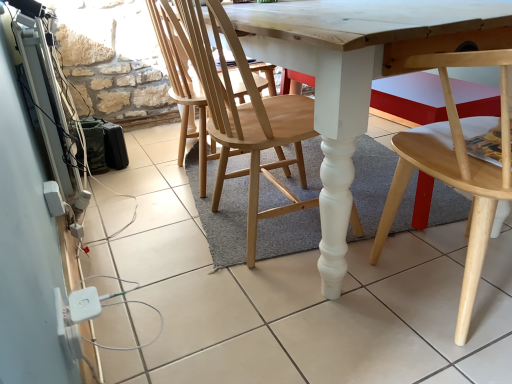
Question: Considering the relative sizes of light wood chair at lower right, the first chair in the right-to-left sequence, and natural wood chair at center, marked as the 1th chair in a left-to-right arrangement, in the image provided, is light wood chair at lower right, the first chair in the right-to-left sequence, wider than natural wood chair at center, marked as the 1th chair in a left-to-right arrangement,?

Choices:
 (A) no
 (B) yes

Answer: (B)

Question: Is the depth of light wood chair at lower right, which is the second chair in left-to-right order, less than that of natural wood chair at center, the 2th chair when ordered from right to left?

Choices:
 (A) yes
 (B) no

Answer: (A)

Question: Is light wood chair at lower right, the first chair in the right-to-left sequence, at the left side of natural wood chair at center, the 2th chair when ordered from right to left?

Choices:
 (A) no
 (B) yes

Answer: (A)

Question: Is light wood chair at lower right, the first chair in the right-to-left sequence, with natural wood chair at center, marked as the 1th chair in a left-to-right arrangement?

Choices:
 (A) yes
 (B) no

Answer: (B)

Question: Can you confirm if light wood chair at lower right, the first chair in the right-to-left sequence, is thinner than natural wood chair at center, the 2th chair when ordered from right to left?

Choices:
 (A) yes
 (B) no

Answer: (B)

Question: Would you say light wood chair at lower right, which is the second chair in left-to-right order, contains natural wood chair at center, the 2th chair when ordered from right to left?

Choices:
 (A) no
 (B) yes

Answer: (A)

Question: Is light wood chair at lower right, the first chair in the right-to-left sequence, inside natural wood chair at center, the 2th chair when ordered from right to left?

Choices:
 (A) yes
 (B) no

Answer: (B)

Question: From the image's perspective, is natural wood chair at center, the 2th chair when ordered from right to left, on light wood chair at lower right, the first chair in the right-to-left sequence?

Choices:
 (A) yes
 (B) no

Answer: (A)

Question: Is natural wood chair at center, marked as the 1th chair in a left-to-right arrangement, shorter than light wood chair at lower right, the first chair in the right-to-left sequence?

Choices:
 (A) no
 (B) yes

Answer: (A)

Question: Can you confirm if natural wood chair at center, the 2th chair when ordered from right to left, is positioned to the right of light wood chair at lower right, which is the second chair in left-to-right order?

Choices:
 (A) yes
 (B) no

Answer: (B)

Question: Does natural wood chair at center, the 2th chair when ordered from right to left, have a smaller size compared to light wood chair at lower right, the first chair in the right-to-left sequence?

Choices:
 (A) no
 (B) yes

Answer: (B)

Question: In the image, is natural wood chair at center, the 2th chair when ordered from right to left, on the left side or the right side of light wood chair at lower right, which is the second chair in left-to-right order?

Choices:
 (A) left
 (B) right

Answer: (A)